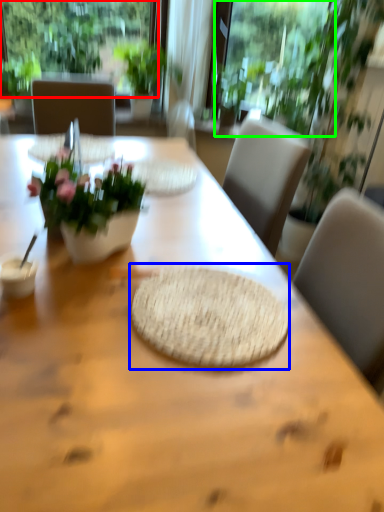
Question: Which is nearer to the window (highlighted by a red box)? mat (highlighted by a blue box) or window screen (highlighted by a green box).

Choices:
 (A) mat
 (B) window screen

Answer: (B)